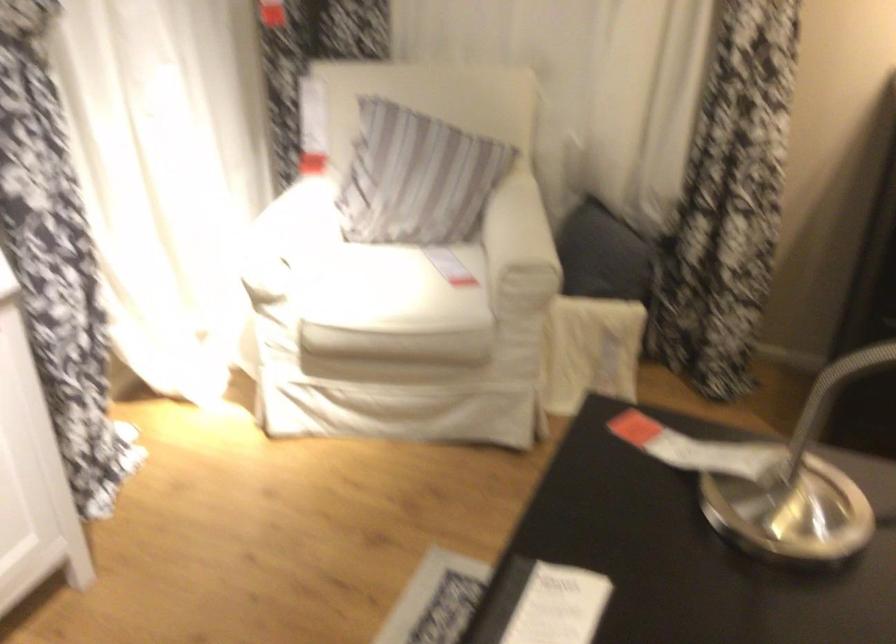
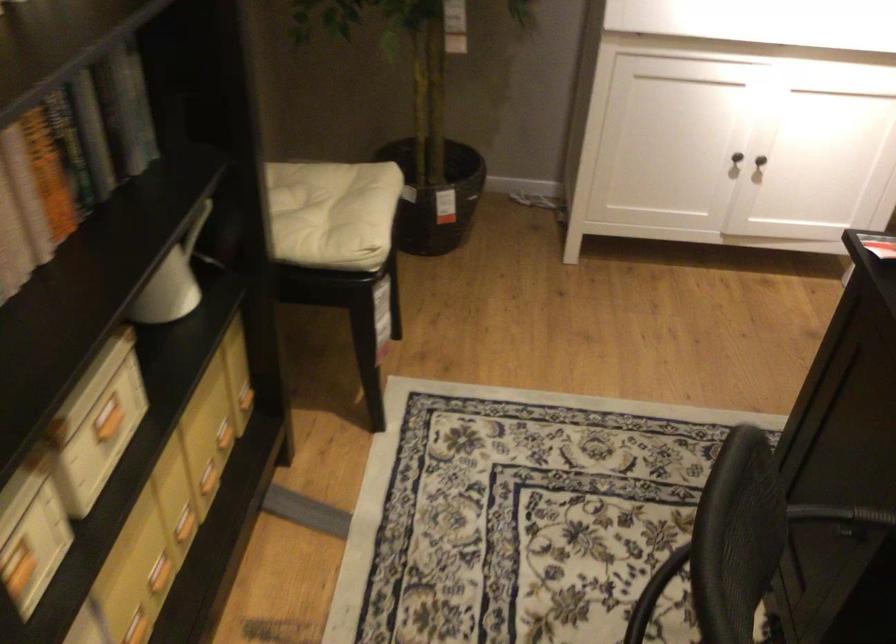
How did the camera likely rotate?

The rotation direction of the camera is left-down.